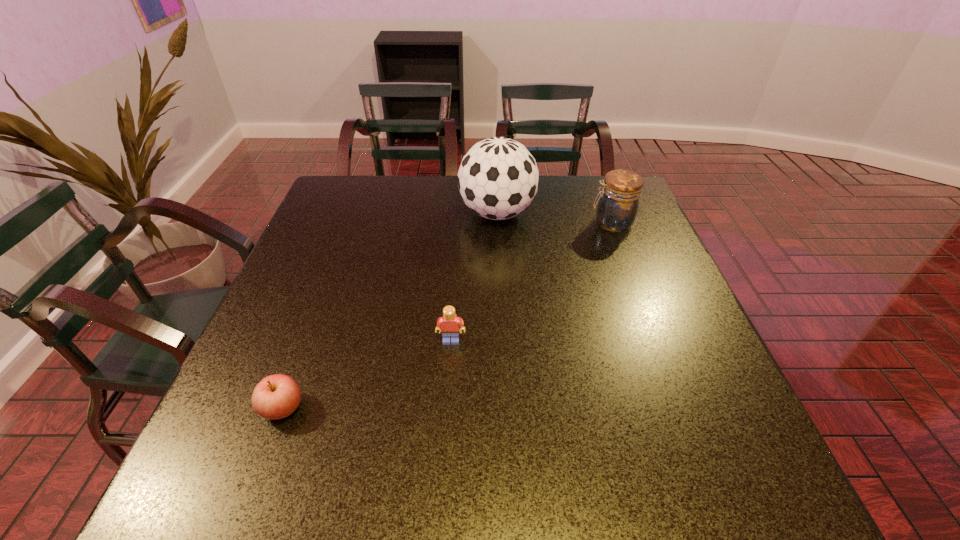
Where is `the second closest object relative to the leftmost object`? the second closest object relative to the leftmost object is located at coordinates (498, 177).

The image size is (960, 540). What are the coordinates of `the second closest object to the Lego` in the screenshot? It's located at (498, 177).

Image resolution: width=960 pixels, height=540 pixels. Identify the location of free space that satisfies the following two spatial constraints: 1. on the lid of the jar; 2. on the front-facing side of the second shortest object. (657, 341).